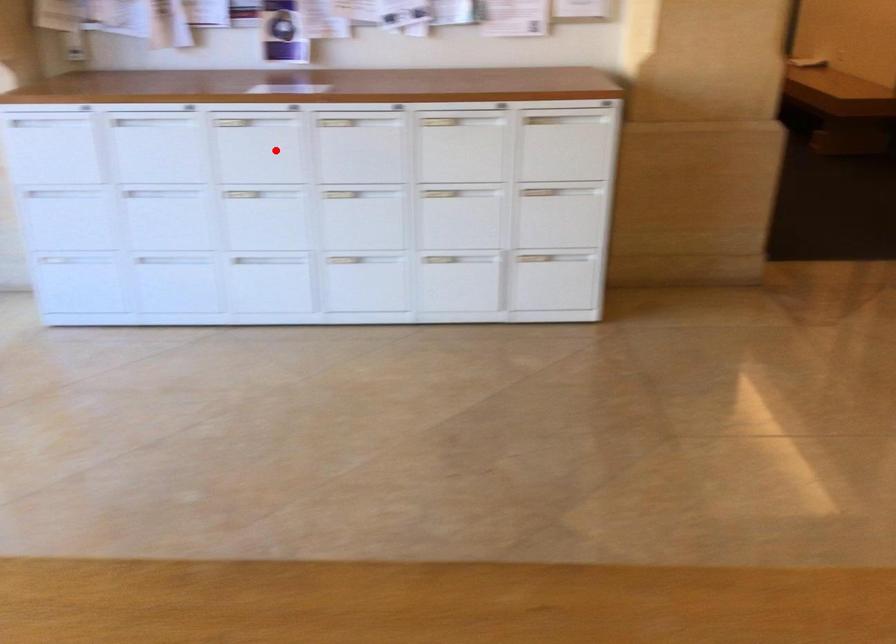
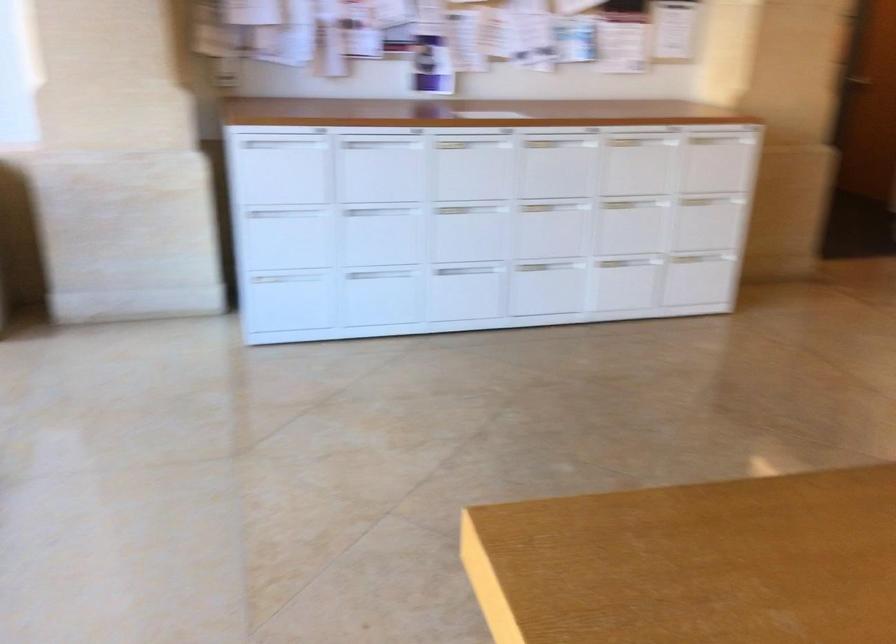
Locate, in the second image, the point that corresponds to the highlighted location in the first image.

(471, 167)